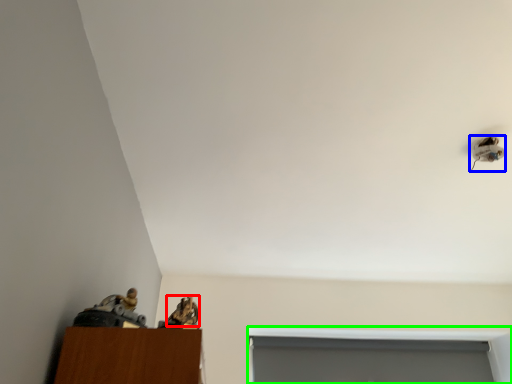
Question: Which object is positioned farthest from animal (highlighted by a red box)? Select from lamp (highlighted by a blue box) and window (highlighted by a green box).

Choices:
 (A) lamp
 (B) window

Answer: (B)